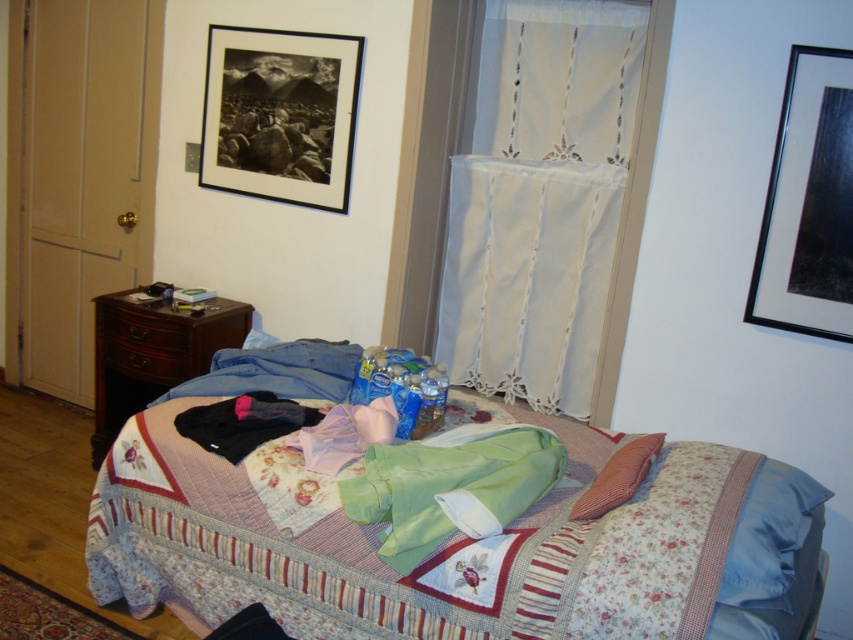
Is white lace curtain at upper center thinner than black fabric at center?

In fact, white lace curtain at upper center might be wider than black fabric at center.

Is point (631, 40) less distant than point (219, 435)?

No, it is behind (219, 435).

You are a GUI agent. You are given a task and a screenshot of the screen. Output one action in this format:
    pyautogui.click(x=<x>, y=<y>)
    Task: Click on the white lace curtain at upper center
    This screenshot has width=853, height=640.
    Given the screenshot: What is the action you would take?
    pyautogui.click(x=575, y=168)

Is point (770, 564) closer to camera compared to point (640, 456)?

Yes, it is.

Is point (761, 481) closer to camera compared to point (585, 500)?

No, it is not.

The width and height of the screenshot is (853, 640). Find the location of `satin blue pillow at lower right`. satin blue pillow at lower right is located at coordinates (769, 536).

Between green satin shirt at center and denim at left, which one is positioned higher?

denim at left

You are a GUI agent. You are given a task and a screenshot of the screen. Output one action in this format:
    pyautogui.click(x=<x>, y=<y>)
    Task: Click on the green satin shirt at center
    This screenshot has width=853, height=640.
    Given the screenshot: What is the action you would take?
    pyautogui.click(x=451, y=484)

At what (x,y) coordinates should I click in order to perform the action: click on green satin shirt at center. Please return your answer as a coordinate pair (x, y). This screenshot has height=640, width=853. Looking at the image, I should click on (451, 484).